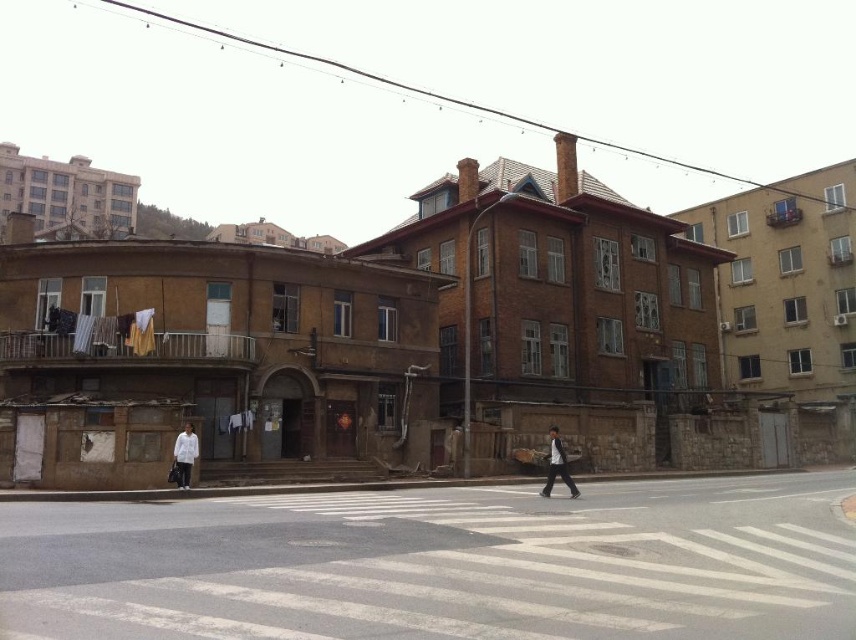
Question: Is white matte jacket at lower left positioned behind dark gray suit at center?

Choices:
 (A) no
 (B) yes

Answer: (B)

Question: Which point is closer to the camera?

Choices:
 (A) (551, 483)
 (B) (849, 560)

Answer: (B)

Question: Which point is farther to the camera?

Choices:
 (A) white asphalt crosswalk at center
 (B) white matte jacket at lower left

Answer: (B)

Question: Can you confirm if white asphalt crosswalk at center is positioned to the right of white matte jacket at lower left?

Choices:
 (A) yes
 (B) no

Answer: (A)

Question: Is white asphalt crosswalk at center above white matte jacket at lower left?

Choices:
 (A) yes
 (B) no

Answer: (A)

Question: Which of the following is the closest to the observer?

Choices:
 (A) white asphalt crosswalk at center
 (B) dark gray suit at center

Answer: (A)